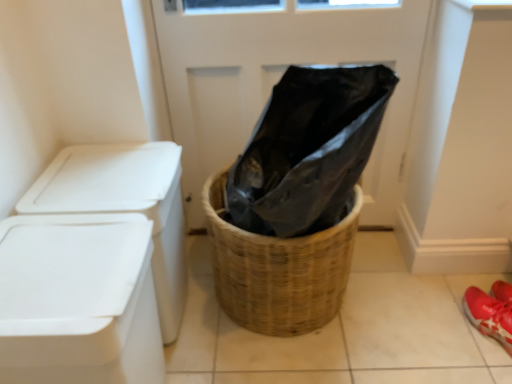
Question: In terms of width, does white plastic container at left look wider or thinner when compared to woven brown basket at center?

Choices:
 (A) wide
 (B) thin

Answer: (B)

Question: In the image, is white plastic container at left on the left side or the right side of woven brown basket at center?

Choices:
 (A) left
 (B) right

Answer: (A)

Question: Which of these objects is positioned farthest from the white plastic container at left?

Choices:
 (A) black plastic bag at center
 (B) white plastic container at left
 (C) woven brown basket at center

Answer: (A)

Question: Based on their relative distances, which object is farther from the white plastic container at left?

Choices:
 (A) white plastic container at left
 (B) black plastic bag at center
 (C) woven brown basket at center

Answer: (B)